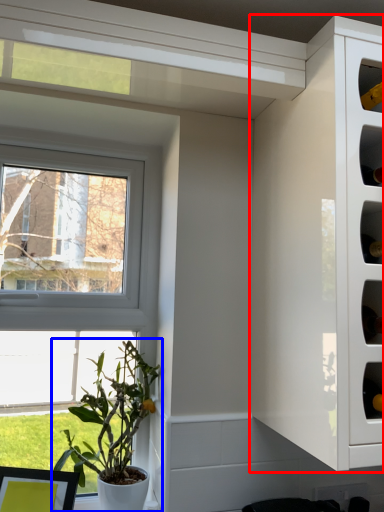
Question: Which object is further to the camera taking this photo, cabinetry (highlighted by a red box) or houseplant (highlighted by a blue box)?

Choices:
 (A) cabinetry
 (B) houseplant

Answer: (B)